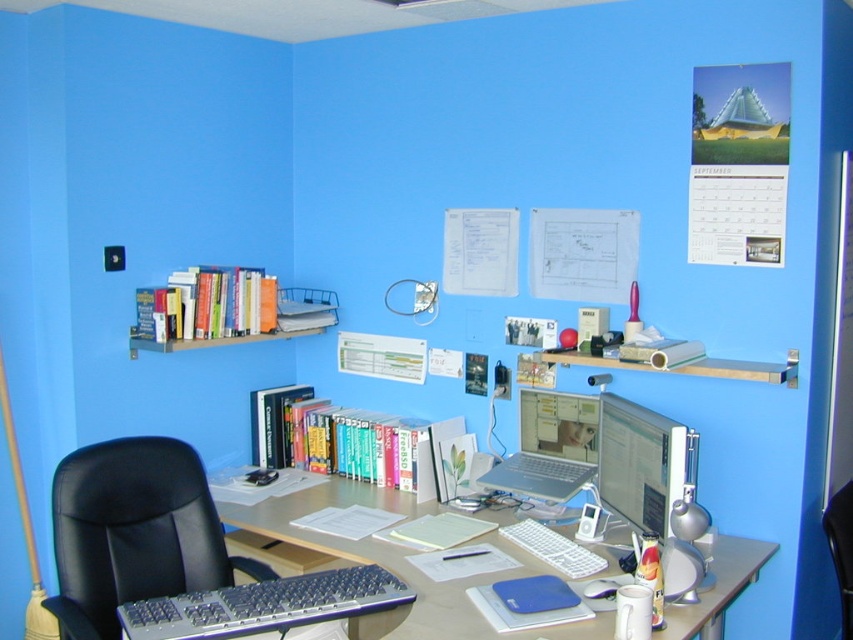
Question: Which of the following is the closest to the observer?

Choices:
 (A) silver metallic keyboard at lower center
 (B) wooden bookshelf at upper center
 (C) matte silver monitor at center

Answer: (A)

Question: Is black leather swivel chair at left positioned behind white plastic computer desk at center?

Choices:
 (A) no
 (B) yes

Answer: (B)

Question: Which object is closer to the camera taking this photo?

Choices:
 (A) white plastic computer desk at center
 (B) black leather swivel chair at left
 (C) wooden bookshelf at upper center

Answer: (A)

Question: Which object appears farthest from the camera in this image?

Choices:
 (A) black leather swivel chair at left
 (B) wooden bookshelf at upper center
 (C) silver metallic keyboard at lower center

Answer: (B)

Question: From the image, what is the correct spatial relationship of hardcover books at center in relation to matte silver monitor at center?

Choices:
 (A) above
 (B) below

Answer: (B)

Question: Is matte silver monitor at center below hardcover books at upper left?

Choices:
 (A) no
 (B) yes

Answer: (B)